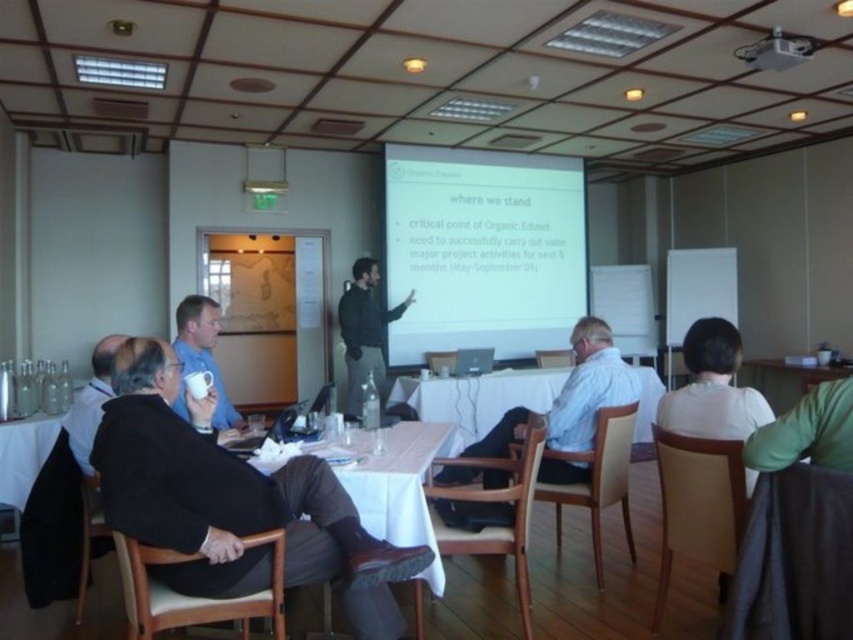
Is black leather jacket at lower left bigger than dark green sweater at center?

Incorrect, black leather jacket at lower left is not larger than dark green sweater at center.

Is point (224, 467) positioned in front of point (358, 394)?

Yes, point (224, 467) is closer to viewer.

Image resolution: width=853 pixels, height=640 pixels. I want to click on black leather jacket at lower left, so click(x=231, y=500).

Is white cloth-covered table at lower center positioned before white plastic projector at upper center?

Yes, it is in front of white plastic projector at upper center.

Which is behind, point (427, 448) or point (787, 38)?

Positioned behind is point (787, 38).

Between point (433, 595) and point (770, 67), which one is positioned behind?

Positioned behind is point (770, 67).

The height and width of the screenshot is (640, 853). I want to click on white cloth-covered table at lower center, so click(x=396, y=483).

Image resolution: width=853 pixels, height=640 pixels. Identify the location of white matte projection screen at center. (483, 250).

Is white matte projection screen at center wider than matte blue shirt at center?

Yes.

Locate an element on the screen. The image size is (853, 640). white matte projection screen at center is located at coordinates (483, 250).

This screenshot has width=853, height=640. I want to click on white matte projection screen at center, so click(483, 250).